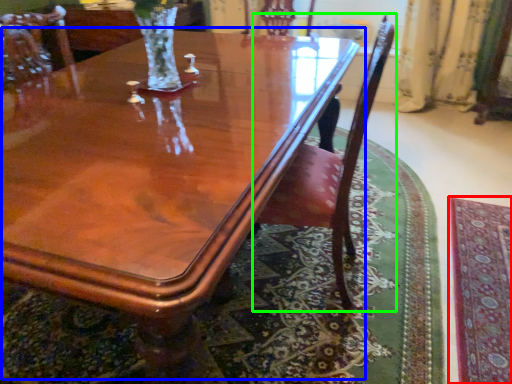
Question: Based on their relative distances, which object is farther from mat (highlighted by a red box)? Choose from coffee table (highlighted by a blue box) and chair (highlighted by a green box).

Choices:
 (A) coffee table
 (B) chair

Answer: (A)